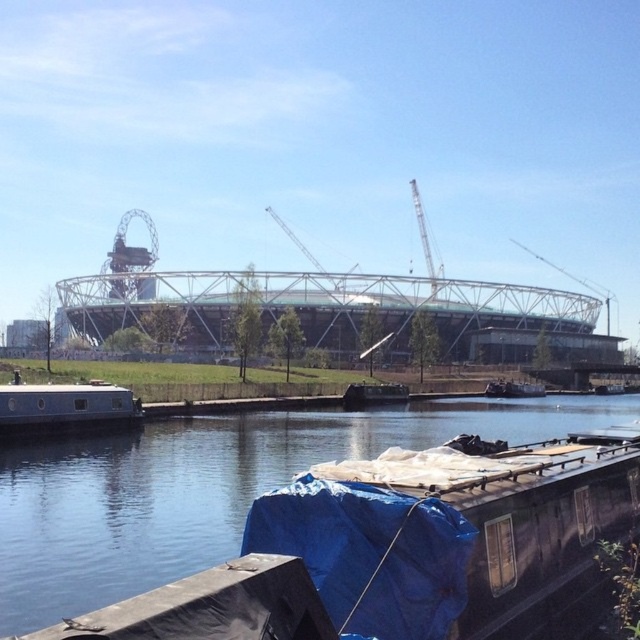
Question: From the image, what is the correct spatial relationship of blue tarp-covered boat at lower right in relation to white matte boat at lower left?

Choices:
 (A) below
 (B) above

Answer: (A)

Question: Observing the image, what is the correct spatial positioning of blue tarp-covered boat at lower right in reference to white matte boat at lower left?

Choices:
 (A) below
 (B) above

Answer: (A)

Question: Is blue tarp-covered boat at lower right smaller than white matte boat at lower left?

Choices:
 (A) no
 (B) yes

Answer: (A)